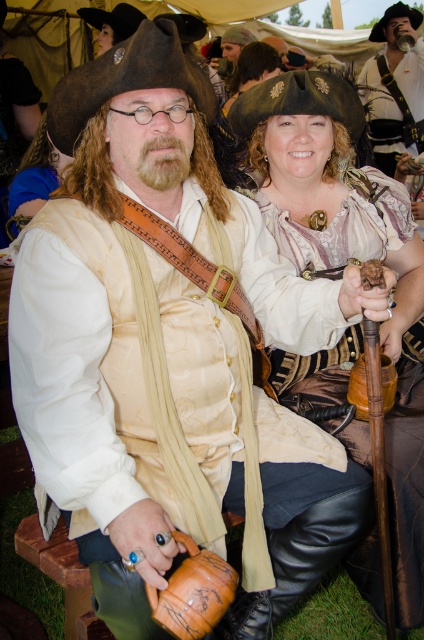
Is matte white shirt at center to the left of matte gold armor at center from the viewer's perspective?

Incorrect, matte white shirt at center is not on the left side of matte gold armor at center.

Measure the distance between point (395, 147) and camera.

A distance of 15.87 feet exists between point (395, 147) and camera.

You are a GUI agent. You are given a task and a screenshot of the screen. Output one action in this format:
    pyautogui.click(x=<x>, y=<y>)
    Task: Click on the matte white shirt at center
    
    Given the screenshot: What is the action you would take?
    click(x=395, y=88)

What do you see at coordinates (334, 198) in the screenshot?
I see `matte gold chain at center` at bounding box center [334, 198].

Does point (398, 182) come farther from viewer compared to point (273, 68)?

No, it is not.

Does point (337, 97) come behind point (247, 81)?

No, (337, 97) is in front of (247, 81).

You are a GUI agent. You are given a task and a screenshot of the screen. Output one action in this format:
    pyautogui.click(x=<x>, y=<y>)
    Task: Click on the matte gold chain at center
    
    Given the screenshot: What is the action you would take?
    pyautogui.click(x=334, y=198)

Does matte gold chain at center appear on the right side of matte white shirt at center?

No, matte gold chain at center is not to the right of matte white shirt at center.

Does matte gold chain at center come behind matte white shirt at center?

No, matte gold chain at center is closer to the viewer.

Does point (286, 113) lie in front of point (384, 65)?

Yes, it is.

The width and height of the screenshot is (424, 640). Find the location of `matte gold chain at center`. matte gold chain at center is located at coordinates (334, 198).